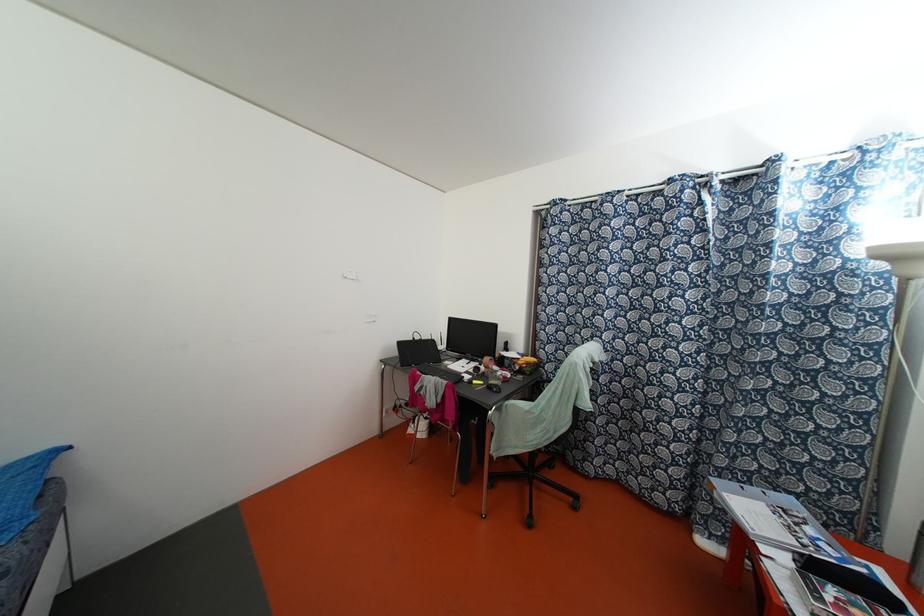
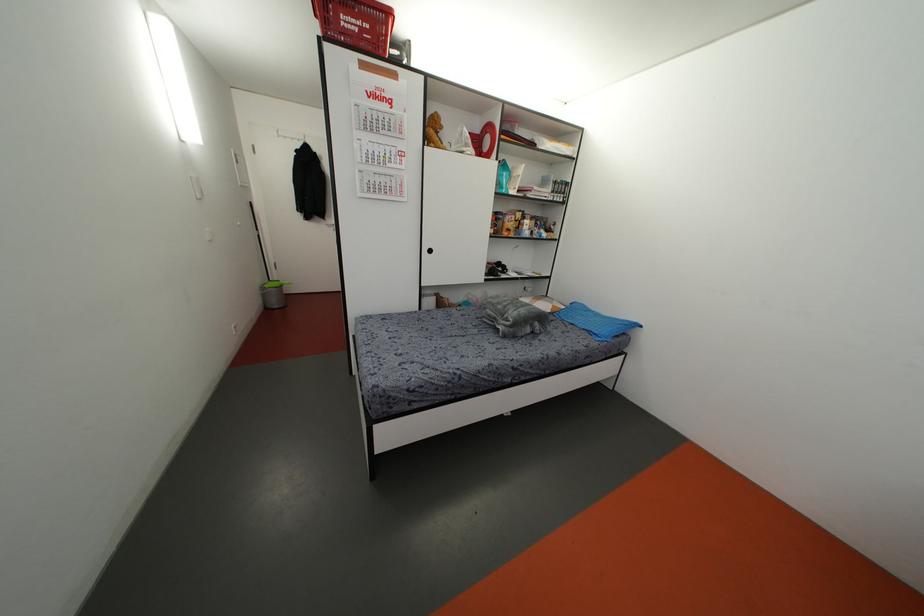
Consider the image. How did the camera likely rotate?

The camera rotated toward left-down.